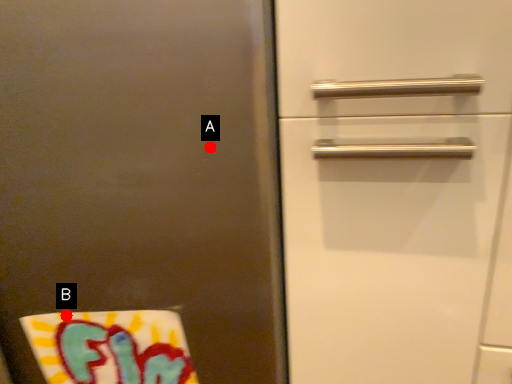
Question: Two points are circled on the image, labeled by A and B beside each circle. Which point is closer to the camera?

Choices:
 (A) A is closer
 (B) B is closer

Answer: (A)